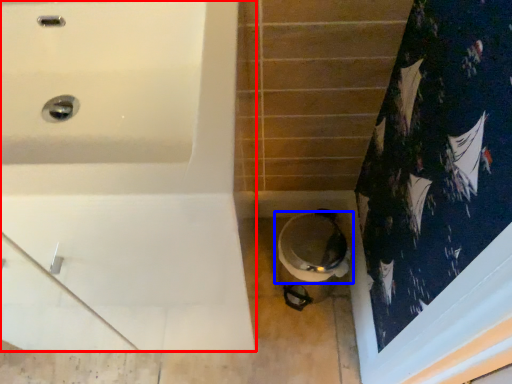
Question: Among these objects, which one is farthest to the camera, bathtub (highlighted by a red box) or toilet (highlighted by a blue box)?

Choices:
 (A) bathtub
 (B) toilet

Answer: (B)